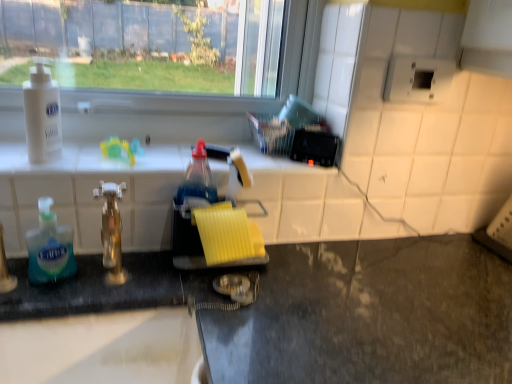
Locate an element on the screen. The image size is (512, 384). spots to the right of gold metallic faucet at center is located at coordinates (196, 304).